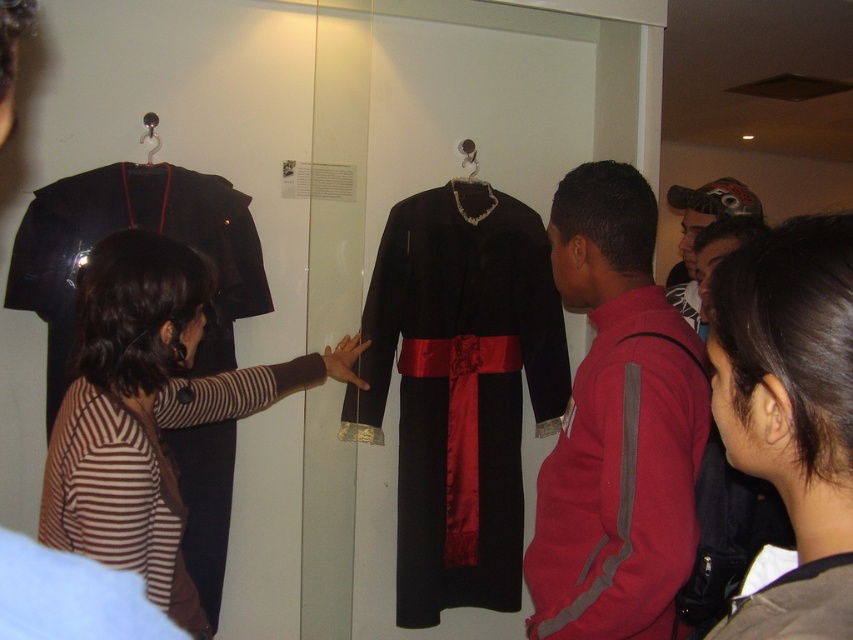
Consider the image. You are a museum curator arranging an exhibit. You need to place a new artifact between the velvet black robe at center and the dark brown hair at center. Where should you place it to maintain the existing arrangement?

The velvet black robe at center is positioned on the left side of dark brown hair at center, so placing the new artifact between them would require placing it to the right of the velvet black robe at center and to the left of the dark brown hair at center, maintaining their original left to right order.